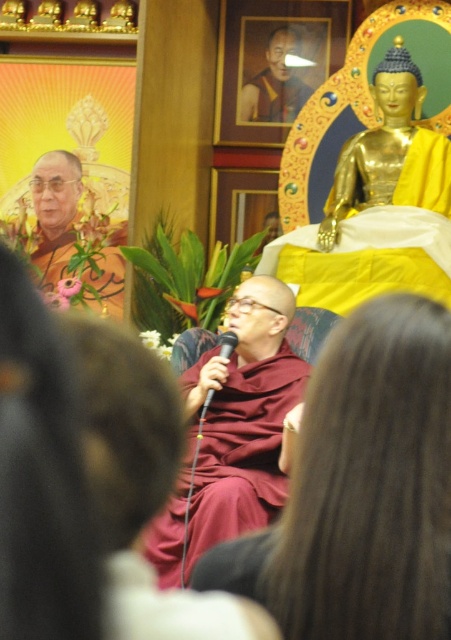
Measure the distance between golden statue at upper left and black plastic microphone at center.

golden statue at upper left is 81.59 feet from black plastic microphone at center.

Between golden statue at upper left and black plastic microphone at center, which one is positioned higher?

golden statue at upper left is above.

Describe the element at coordinates (55, 212) in the screenshot. I see `golden statue at upper left` at that location.

Find the location of `golden statue at upper left`. golden statue at upper left is located at coordinates (55, 212).

Is point (225, 365) positioned in front of point (401, 65)?

That is True.

Does maroon cloth at center appear over gold polished buddha at upper right?

No.

This screenshot has width=451, height=640. I want to click on maroon cloth at center, so click(233, 433).

Does maroon cloth at center have a lesser width compared to black plastic microphone at center?

No, maroon cloth at center is not thinner than black plastic microphone at center.

Which is behind, point (216, 384) or point (220, 336)?

Positioned behind is point (220, 336).

Identify the location of maroon cloth at center. The height and width of the screenshot is (640, 451). (233, 433).